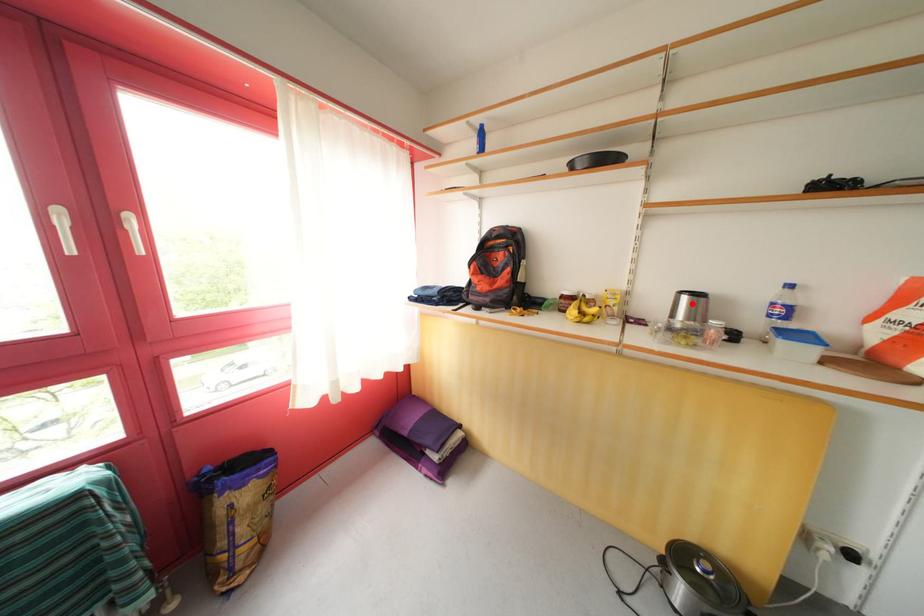
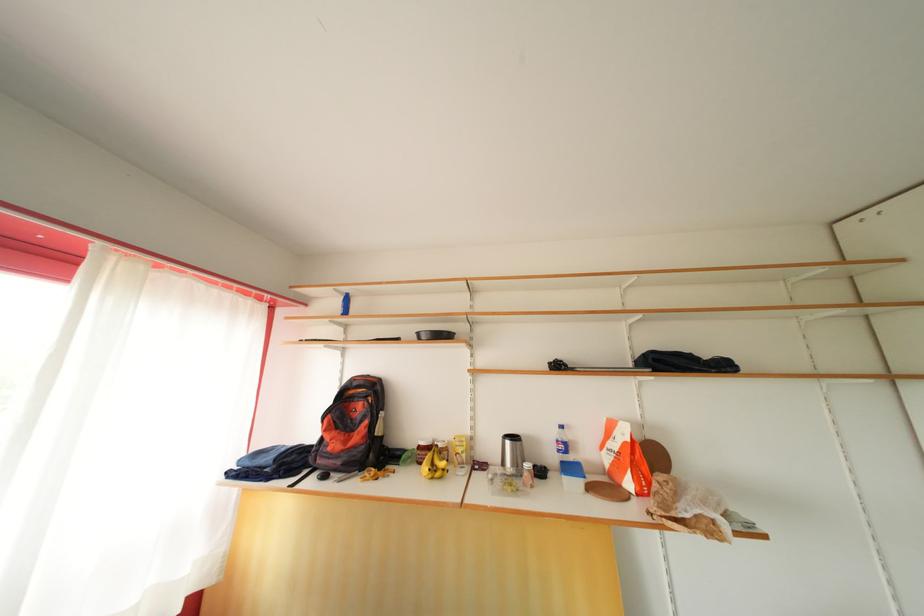
The point at the highlighted location is marked in the first image. Where is the corresponding point in the second image?

(515, 448)